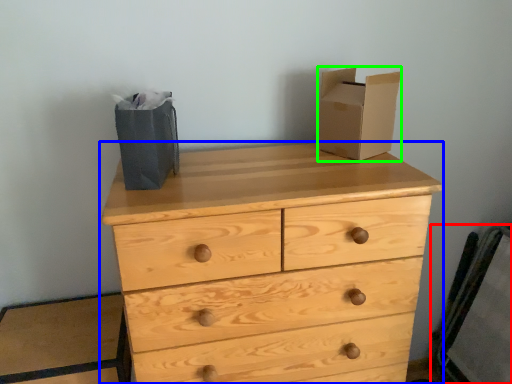
Question: Based on their relative distances, which object is farther from chair (highlighted by a red box)? Choose from chest of drawers (highlighted by a blue box) and cardboard box (highlighted by a green box).

Choices:
 (A) chest of drawers
 (B) cardboard box

Answer: (B)